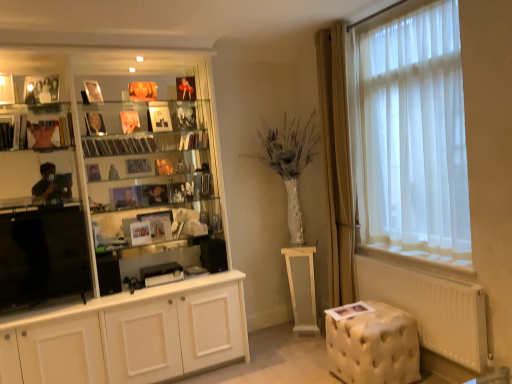
Question: Which direction should I rotate to face metallic glass book at center, the 4th book positioned from the left, — up or down?

Choices:
 (A) down
 (B) up

Answer: (B)

Question: Which direction should I rotate to look at transparent plastic cds at center, which is the fourth book in right-to-left order?

Choices:
 (A) left
 (B) right

Answer: (A)

Question: Would you consider white glossy pedestal at center to be distant from white paper book at lower right, the 5th book viewed from the left?

Choices:
 (A) yes
 (B) no

Answer: (B)

Question: From a real-world perspective, is white glossy pedestal at center positioned over white paper book at lower right, arranged as the 5th book when viewed from the top, based on gravity?

Choices:
 (A) no
 (B) yes

Answer: (A)

Question: From the image's perspective, is white glossy pedestal at center under white paper book at lower right, which is the 1th book in bottom-to-top order?

Choices:
 (A) no
 (B) yes

Answer: (B)

Question: Considering the relative sizes of white glossy pedestal at center and white paper book at lower right, which is the 1th book in bottom-to-top order, in the image provided, is white glossy pedestal at center bigger than white paper book at lower right, which is the 1th book in bottom-to-top order,?

Choices:
 (A) yes
 (B) no

Answer: (A)

Question: Does white glossy pedestal at center come in front of white paper book at lower right, which is the 1th book in bottom-to-top order?

Choices:
 (A) yes
 (B) no

Answer: (B)

Question: Is white glossy pedestal at center taller than white paper book at lower right, which is the 1th book in bottom-to-top order?

Choices:
 (A) no
 (B) yes

Answer: (B)

Question: Is white paper book at lower right, the 5th book viewed from the left, not close to white glossy cupboard at left?

Choices:
 (A) no
 (B) yes

Answer: (B)

Question: Can you confirm if white paper book at lower right, which is the 1th book from right to left, is shorter than white glossy cupboard at left?

Choices:
 (A) no
 (B) yes

Answer: (B)

Question: Considering the relative sizes of white paper book at lower right, which is the 1th book from right to left, and white glossy cupboard at left in the image provided, is white paper book at lower right, which is the 1th book from right to left, bigger than white glossy cupboard at left?

Choices:
 (A) yes
 (B) no

Answer: (B)

Question: From the image's perspective, is white paper book at lower right, which is the 1th book in bottom-to-top order, below white glossy cupboard at left?

Choices:
 (A) no
 (B) yes

Answer: (B)

Question: Is white paper book at lower right, which is the 1th book from right to left, at the left side of white glossy cupboard at left?

Choices:
 (A) yes
 (B) no

Answer: (B)

Question: Is white paper book at lower right, arranged as the 5th book when viewed from the top, facing towards white glossy cupboard at left?

Choices:
 (A) yes
 (B) no

Answer: (B)

Question: Is the surface of tufted cream ottoman at lower right in direct contact with matte glass shelf at left?

Choices:
 (A) yes
 (B) no

Answer: (B)